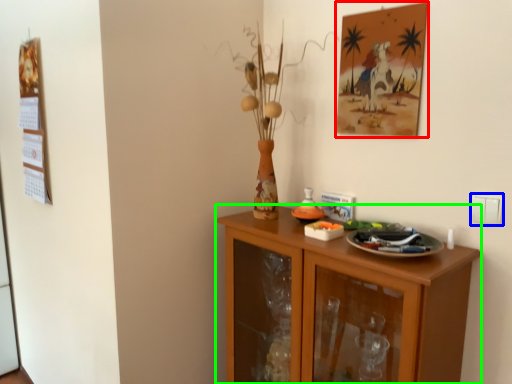
Question: Which object is the closest to the picture frame (highlighted by a red box)? Choose among these: electric outlet (highlighted by a blue box) or cabinetry (highlighted by a green box).

Choices:
 (A) electric outlet
 (B) cabinetry

Answer: (A)